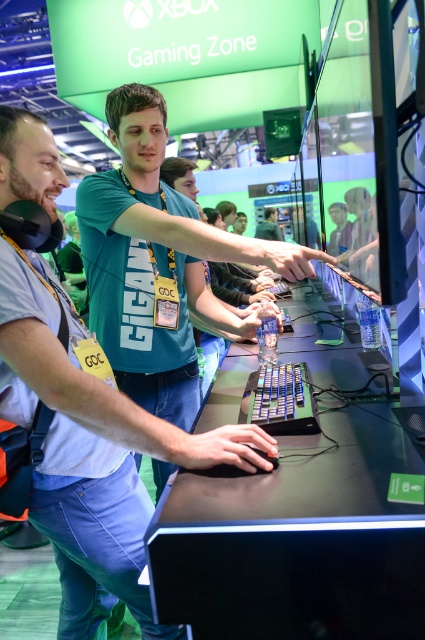
Looking at this image, you are organizing a gaming event and need to ensure there is enough space between the black plastic keyboard at center and the matte green shirt at center for participants to move comfortably. Based on their sizes, do you think the space between them is sufficient?

The black plastic keyboard at center has a larger size compared to matte green shirt at center, so the space between them may be sufficient for participants to move comfortably.

You are a photographer at the event and want to capture a photo where both the black plastic keyboard at center and the matte green shirt at center are clearly visible. Based on their positions, which object should you adjust your focus on to ensure both are in focus?

Since the black plastic keyboard at center is closer to the viewer than the matte green shirt at center, you should focus on the keyboard to ensure both objects are within the depth of field and appear sharp in the photo.

What are the coordinates of the black plastic keyboard at center?

The black plastic keyboard at center is located at coordinates point (280,400).